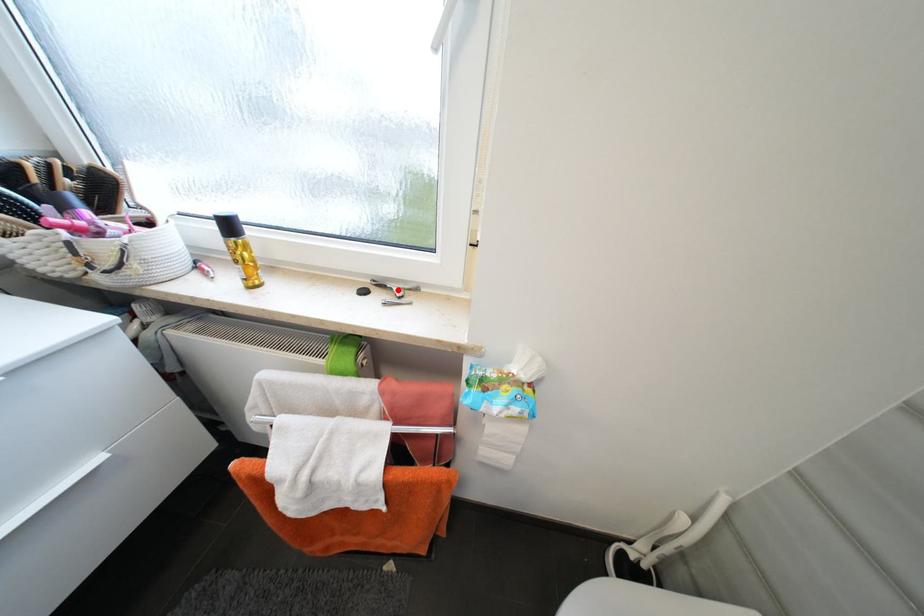
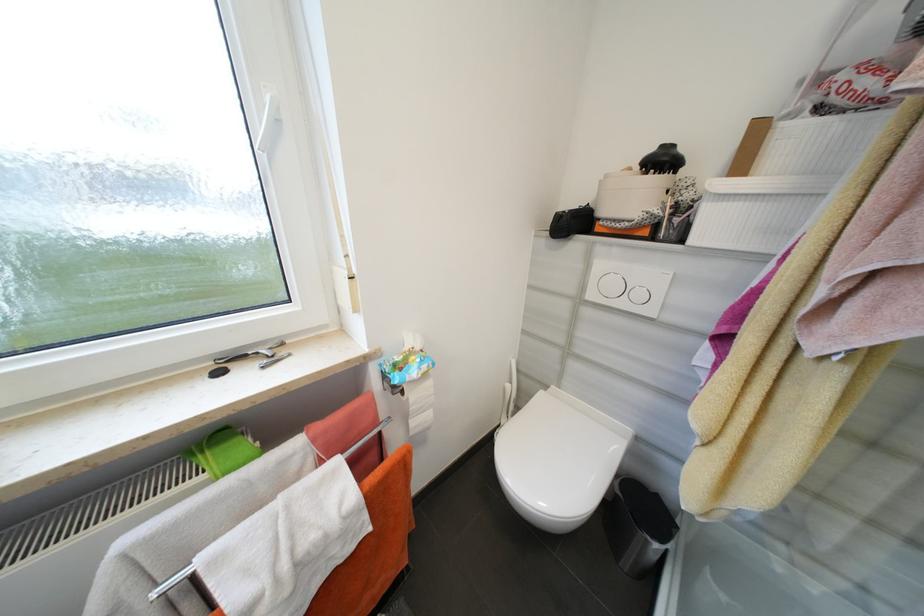
The point at the highlighted location is marked in the first image. Where is the corresponding point in the second image?

(262, 354)